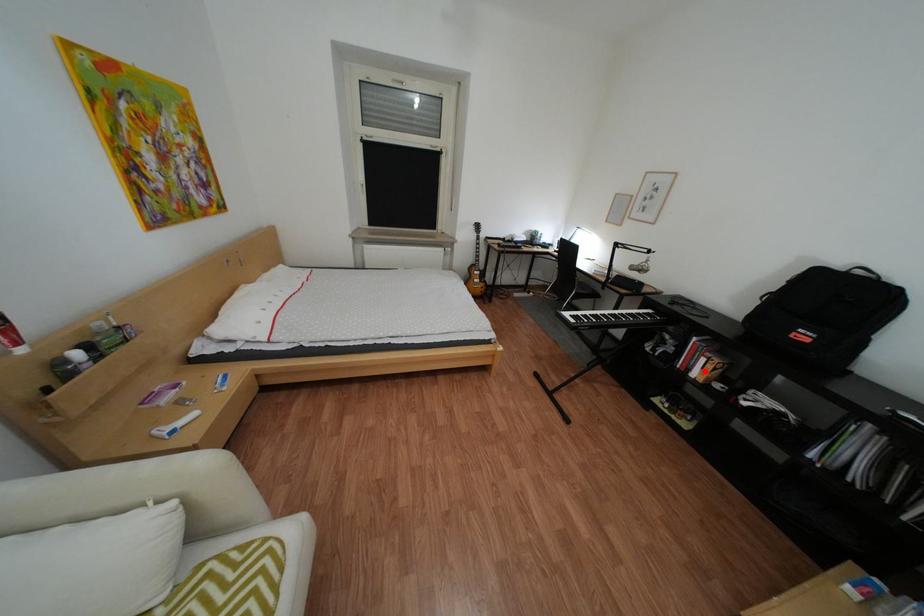
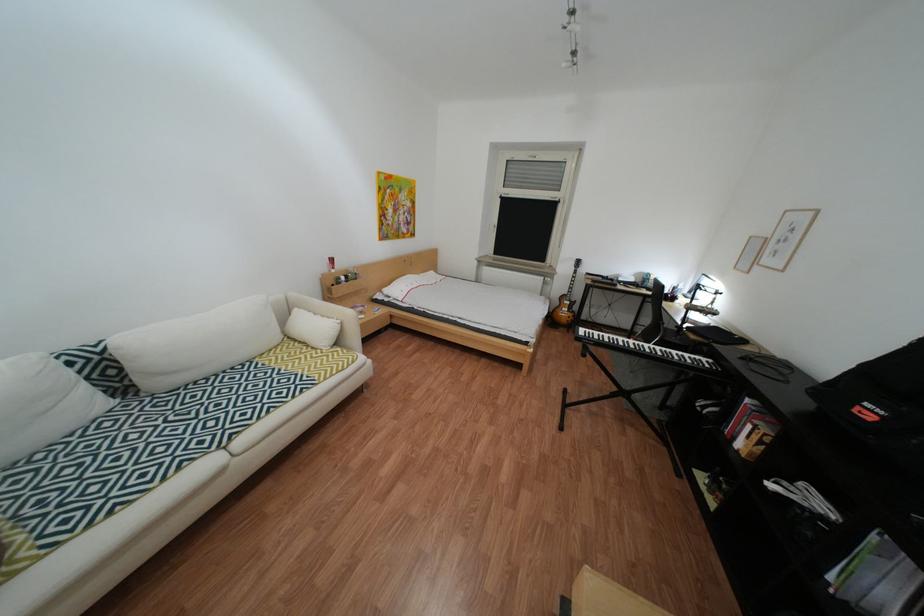
Question: I am providing you with two images of the same scene from different viewpoints. Image1 has a red point marked. In image2, the corresponding 3D location appears at what relative position? Reply with the corresponding letter.

Choices:
 (A) Closer
 (B) Farther

Answer: (B)